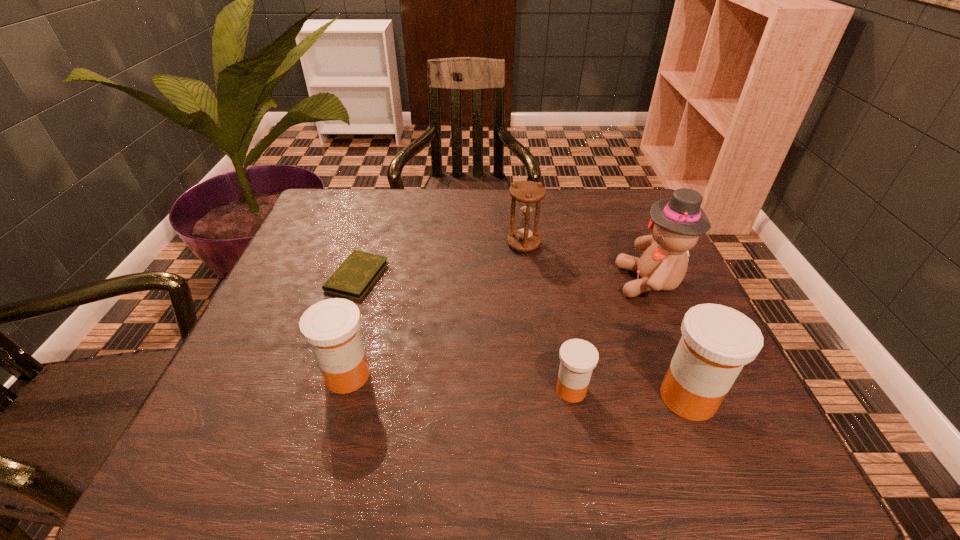
If the aim is uniform spacing by inserting an additional medicine among them, please point to a vacant space for this new medicine. Please provide its 2D coordinates. Your answer should be formatted as a tuple, i.e. [(x, y)], where the tuple contains the x and y coordinates of a point satisfying the conditions above.

[(458, 382)]